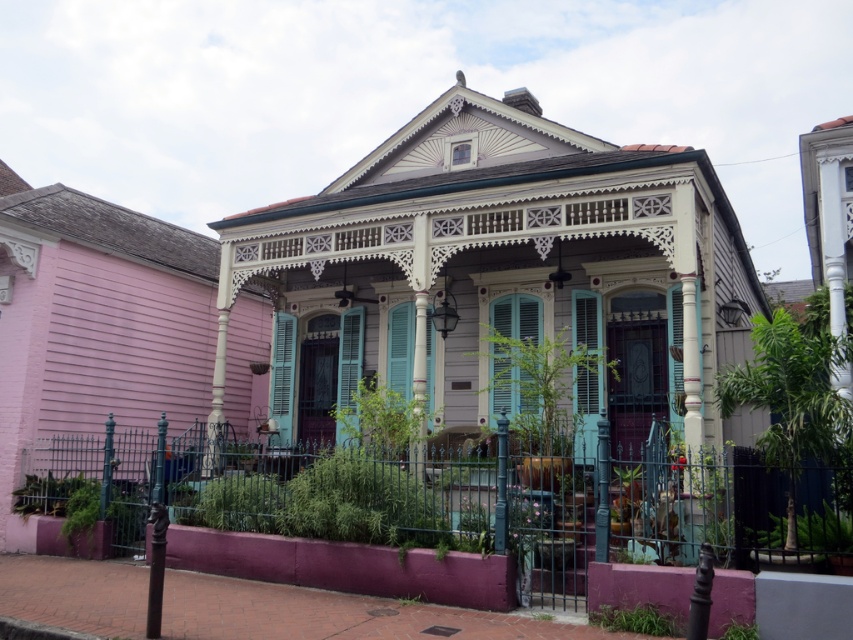
You are a painter who needs to place a ladder between the teal matte shutter at center and the matte teal shutter at center. The ladder is 36 inches long. Will the ladder fit between them?

The teal matte shutter at center and the matte teal shutter at center are 36.76 inches apart from each other. Since the ladder is 36 inches long, it will fit between them as the distance is slightly larger than the ladder.